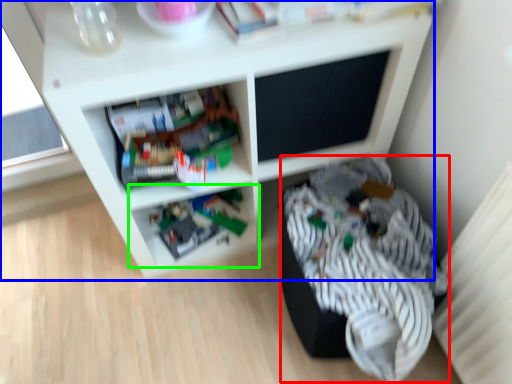
Question: Which object is the farthest from clothing (highlighted by a red box)? Choose among these: shelf (highlighted by a blue box) or shelf (highlighted by a green box).

Choices:
 (A) shelf
 (B) shelf

Answer: (B)